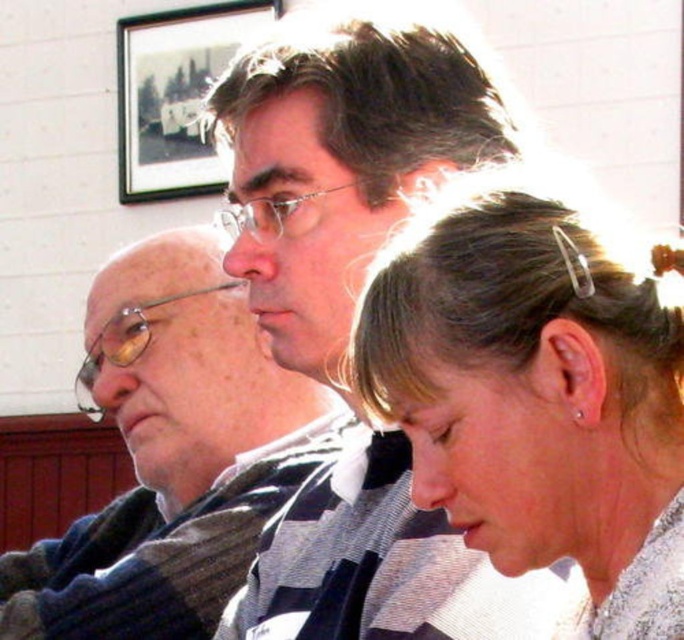
You are a photographer adjusting your camera settings. You want to ensure that the sleek silver hair clip at upper right is centered in your viewfinder. What adjustment should you make to the camera position?

To center the sleek silver hair clip at upper right, move the camera slightly to the left and down since its current position is at point [536,388], meaning it is to the right and above the center of the frame.

You are a photographer adjusting your camera settings to capture a detailed shot of both the sleek silver hair clip at upper right and the wooden framed picture at upper center. Which object should you focus on first to ensure both are in sharp focus?

You should focus on the sleek silver hair clip at upper right first because it is closer to the viewer than the wooden framed picture at upper center. By focusing on the closer object, the depth of field may allow the farther object to also be in focus.